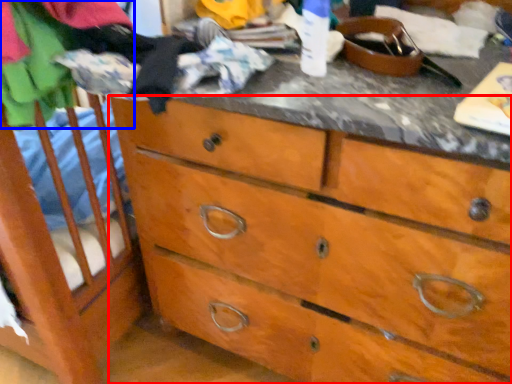
Question: Which object appears farthest to the camera in this image, chest of drawers (highlighted by a red box) or clothing (highlighted by a blue box)?

Choices:
 (A) chest of drawers
 (B) clothing

Answer: (B)